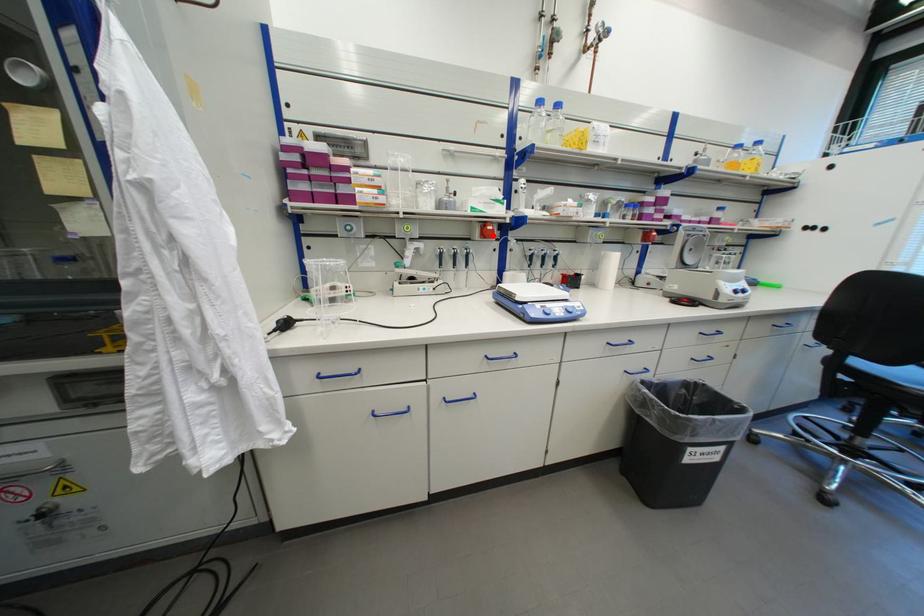
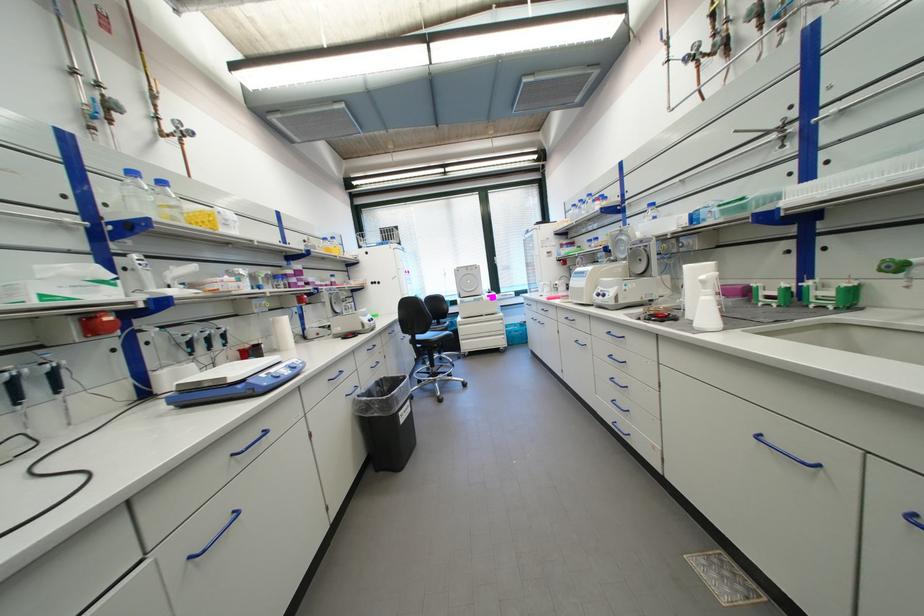
In the second image, find the point that corresponds to the highlighted location in the first image.

(101, 331)